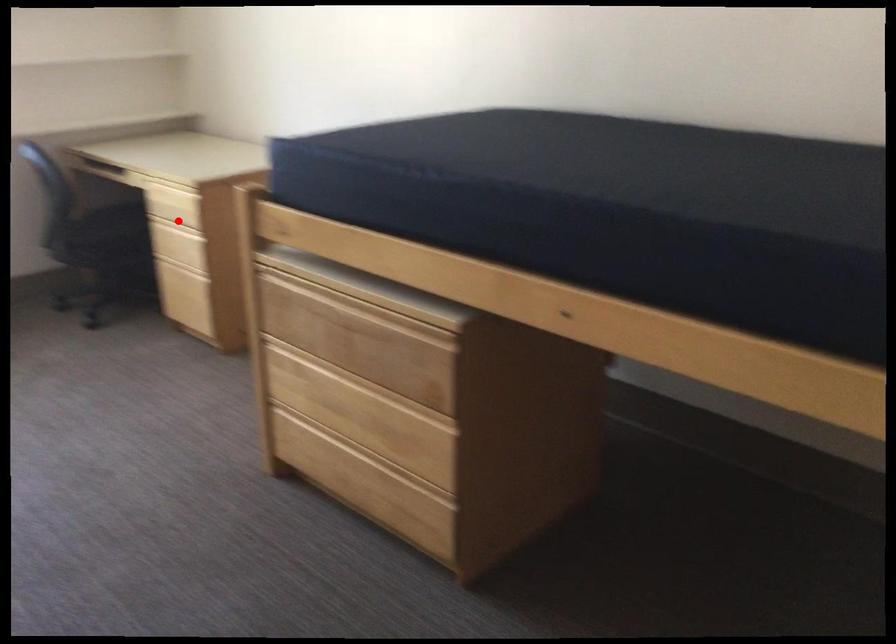
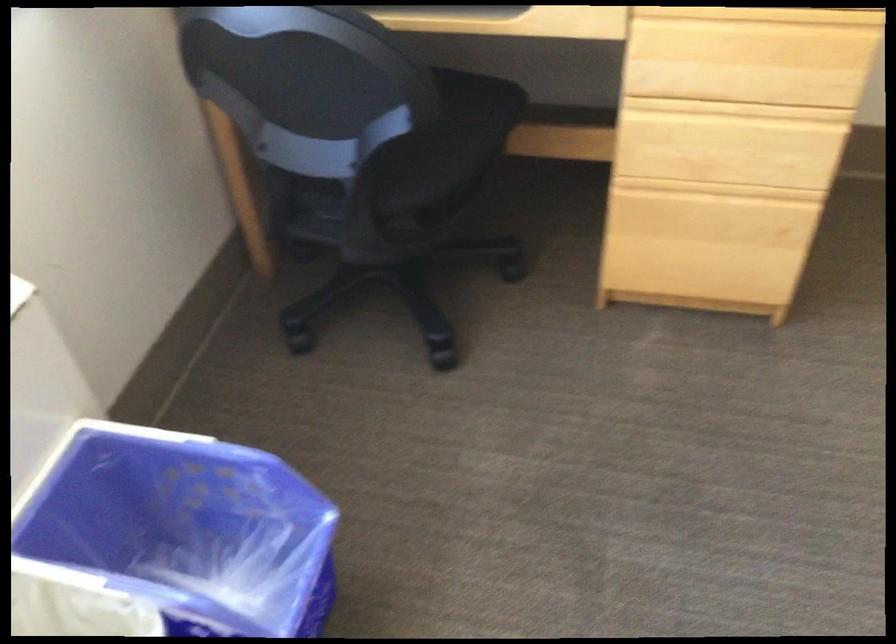
The point at the highlighted location is marked in the first image. Where is the corresponding point in the second image?

(736, 109)